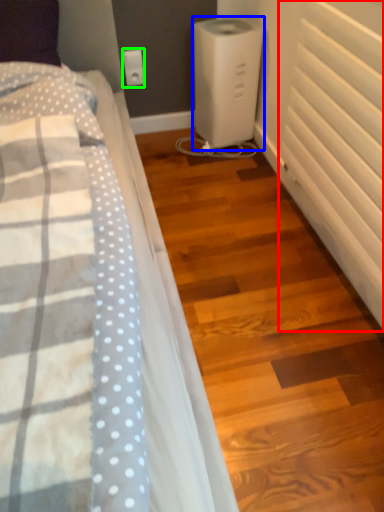
Question: Which object is positioned farthest from radiator (highlighted by a red box)? Select from home appliance (highlighted by a blue box) and electric outlet (highlighted by a green box).

Choices:
 (A) home appliance
 (B) electric outlet

Answer: (B)